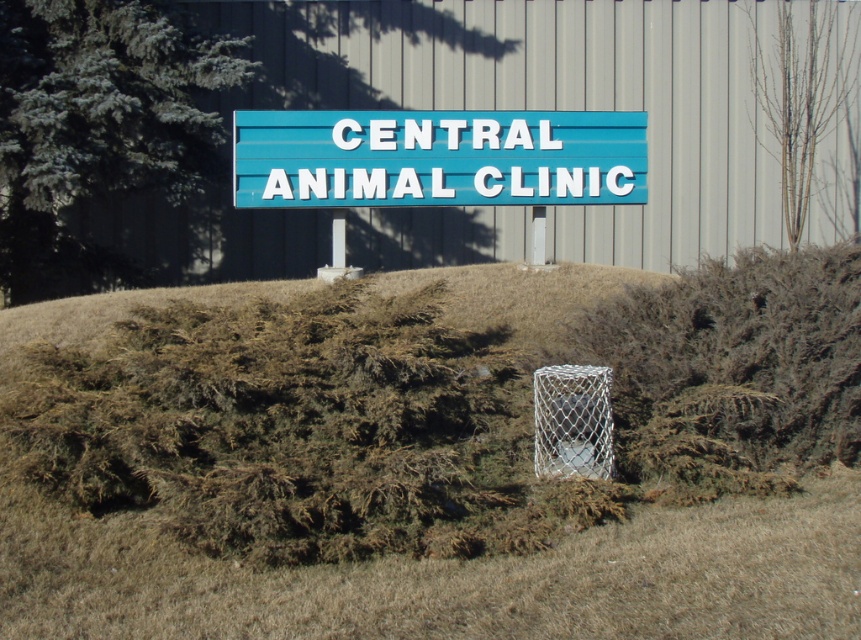
You are a delivery person trying to park your van in front of the Central Animal Clinic. The van is 2 meters wide. The blue plastic sign at center and the white mesh basketball hoop at center are in the way. Can you fit your van between them?

The blue plastic sign at center is wider than the white mesh basketball hoop at center. Since the van is 2 meters wide, you need to check the distance between them. However, the description only provides information about their widths, not the space between them. Therefore, it is impossible to determine if the van can fit based on the given information.

You are standing in front of the Central Animal Clinic sign and notice two points marked on the ground. The first point is at coordinates point (518,160) and the second is at point (544,410). If you want to place a flower pot between them, which point should you start from to ensure the pot is closer to the sign?

You should start from point (544,410) because it is closer to the sign. Since point (518,160) is further away from the camera, placing the pot starting from the closer point ensures it is nearer to the sign.

Based on the photo, you are a delivery person trying to locate the Central Animal Clinic. You see the blue plastic sign at center and the white mesh basketball hoop at center in the image. Which object is positioned higher from the ground?

The blue plastic sign at center is above the white mesh basketball hoop at center, so the blue plastic sign at center is positioned higher from the ground.